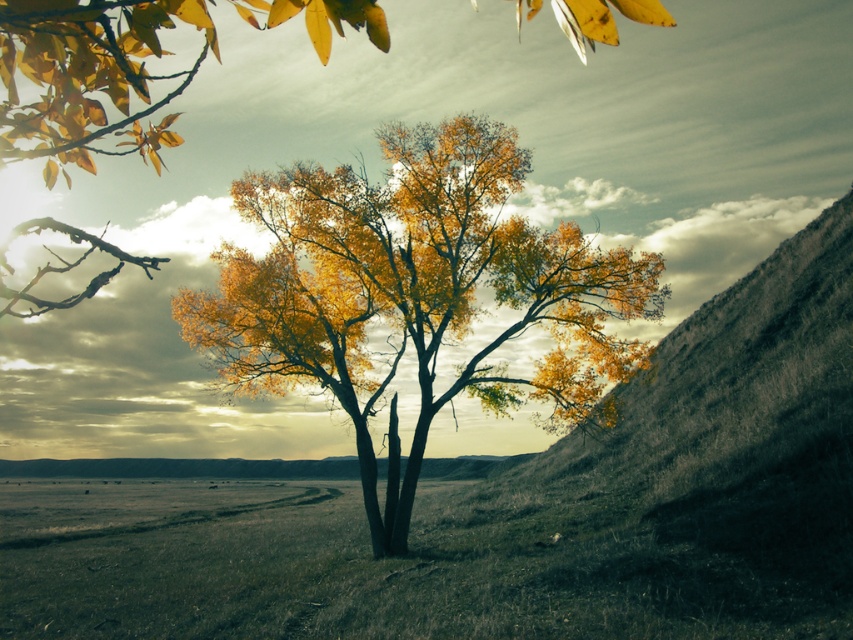
Who is positioned more to the left, golden textured tree at center or yellow-green foliage at center?

yellow-green foliage at center is more to the left.

Between golden textured tree at center and yellow-green foliage at center, which one has less height?

Standing shorter between the two is yellow-green foliage at center.

Who is more forward, (x=560, y=355) or (x=57, y=51)?

Point (x=57, y=51) is in front.

Find the location of a particular element. The image size is (853, 640). golden textured tree at center is located at coordinates (416, 292).